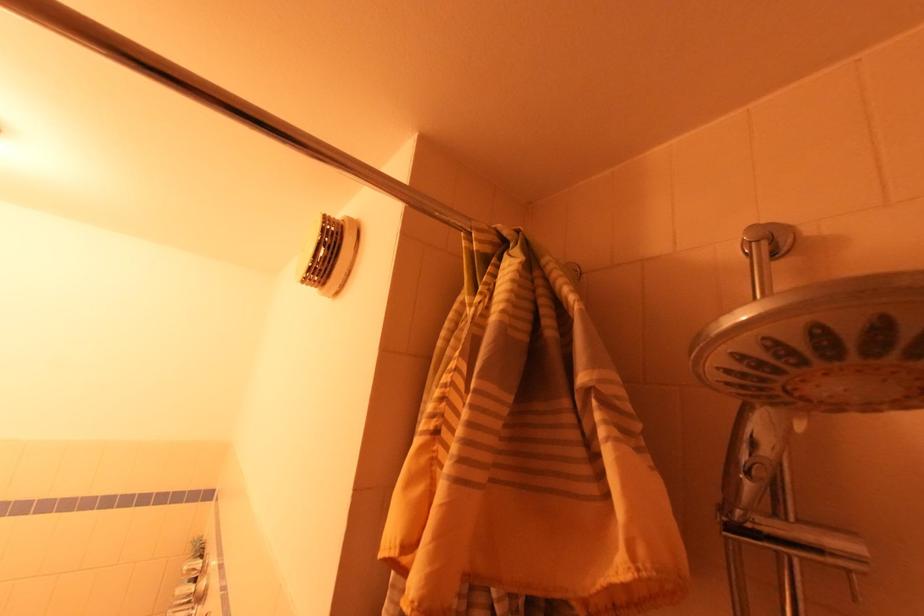
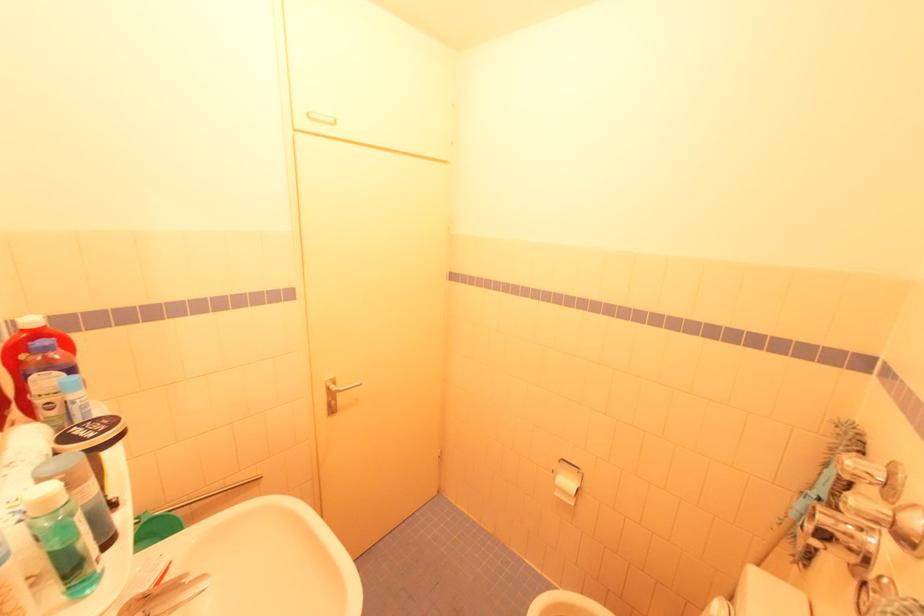
Question: The camera is either moving clockwise (left) or counter-clockwise (right) around the object. The first image is from the beginning of the video and the second image is from the end. Is the camera moving left or right when shooting the video?

Choices:
 (A) Left
 (B) Right

Answer: (B)